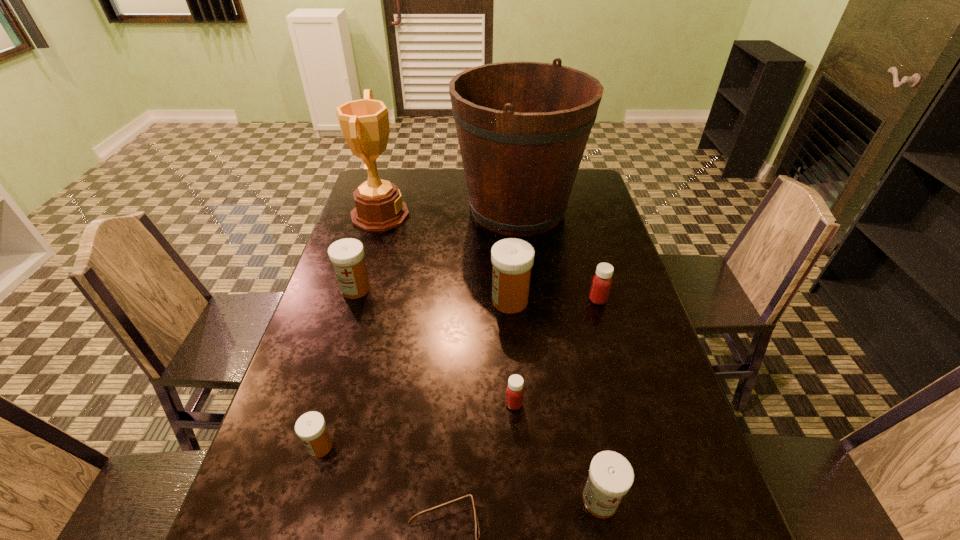
I want to click on bucket, so pos(522,127).

The image size is (960, 540). I want to click on award, so click(x=364, y=123).

Where is `the third white medicine from left to right`? The height and width of the screenshot is (540, 960). the third white medicine from left to right is located at coordinates 512,259.

You are a GUI agent. You are given a task and a screenshot of the screen. Output one action in this format:
    pyautogui.click(x=<x>, y=<y>)
    Task: Click on the biggest white medicine
    
    Given the screenshot: What is the action you would take?
    pyautogui.click(x=512, y=259)

Identify the location of the second tallest medicine. This screenshot has width=960, height=540. (347, 255).

This screenshot has height=540, width=960. Identify the location of the fourth tallest object. (347, 255).

At what (x,y) coordinates should I click in order to perform the action: click on the rightmost medicine. Please return your answer as a coordinate pair (x, y). Image resolution: width=960 pixels, height=540 pixels. Looking at the image, I should click on (602, 281).

Identify the location of the right red medicine. (602, 281).

This screenshot has width=960, height=540. In order to click on the second smallest white medicine in this screenshot , I will do `click(611, 475)`.

Find the location of `the fifth medicine from left to right`. the fifth medicine from left to right is located at coordinates (611, 475).